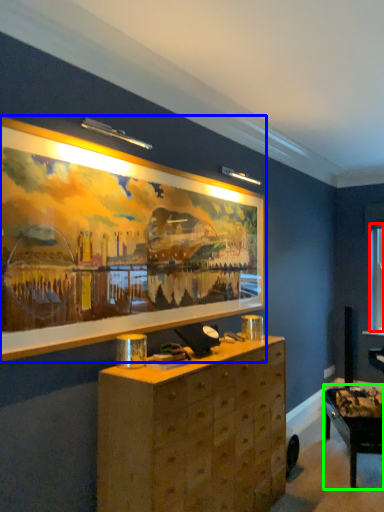
Question: Which object is the closest to the window (highlighted by a red box)? Choose among these: picture frame (highlighted by a blue box) or table (highlighted by a green box).

Choices:
 (A) picture frame
 (B) table

Answer: (B)